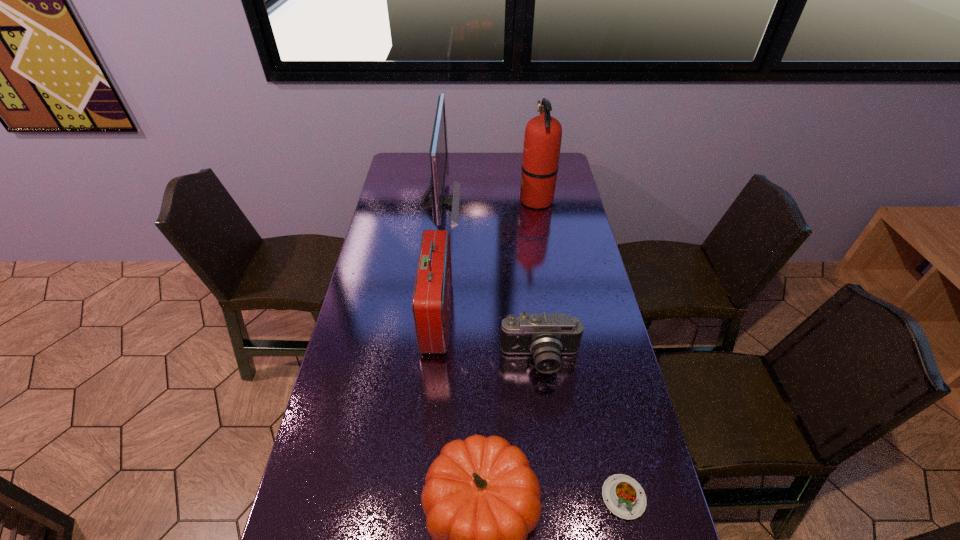
At what (x,y) coordinates should I click in order to perform the action: click on free spot at the right edge of the desktop. Please return your answer as a coordinate pair (x, y). Looking at the image, I should click on (563, 252).

This screenshot has height=540, width=960. I want to click on vacant space at the far left corner, so click(421, 158).

Image resolution: width=960 pixels, height=540 pixels. In order to click on free area in between the fire extinguisher and the camera in this screenshot , I will do `click(539, 280)`.

Locate an element on the screen. This screenshot has width=960, height=540. free spot between the third tallest object and the tallest object is located at coordinates (487, 258).

You are a GUI agent. You are given a task and a screenshot of the screen. Output one action in this format:
    pyautogui.click(x=<x>, y=<y>)
    Task: Click on the free spot between the fourth shortest object and the pudding
    The height and width of the screenshot is (540, 960).
    Given the screenshot: What is the action you would take?
    pyautogui.click(x=530, y=407)

Where is `vacant region between the shortest object and the camera`? vacant region between the shortest object and the camera is located at coordinates (582, 428).

Where is `free space between the fourth shortest object and the pudding`? free space between the fourth shortest object and the pudding is located at coordinates (530, 407).

This screenshot has width=960, height=540. I want to click on object that is the second closest to the monitor, so click(x=542, y=141).

Select which object is the third closest to the second tallest object. Please provide its 2D coordinates. Your answer should be formatted as a tuple, i.e. [(x, y)], where the tuple contains the x and y coordinates of a point satisfying the conditions above.

[(546, 336)]

At what (x,y) coordinates should I click in order to perform the action: click on free space that satisfies the following two spatial constraints: 1. on the front-facing side of the camera; 2. on the left side of the shortest object. Please return your answer as a coordinate pair (x, y). This screenshot has height=540, width=960. Looking at the image, I should click on (557, 497).